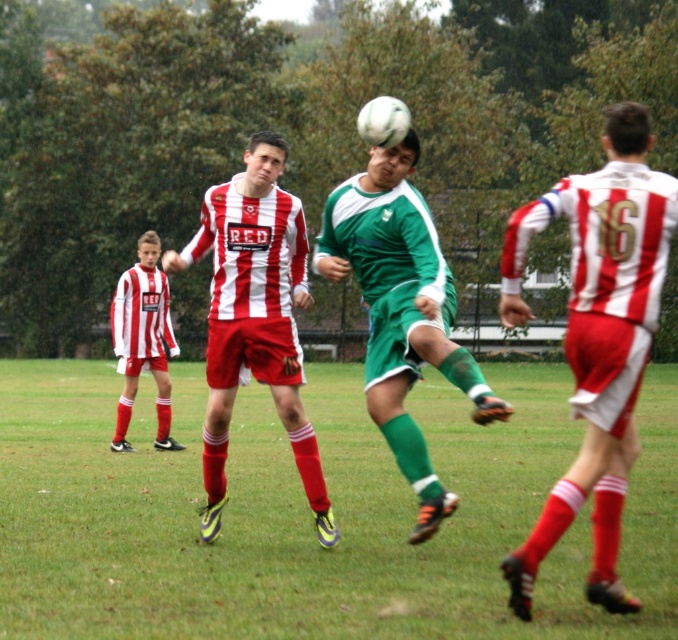
Is green grass at center wider than striped jersey at right?

Yes, green grass at center is wider than striped jersey at right.

Can you confirm if green grass at center is positioned above striped jersey at right?

No.

What are the coordinates of `green grass at center` in the screenshot? It's located at 308,513.

Does white matte soccer ball at center have a lesser width compared to striped jersey at right?

No, white matte soccer ball at center is not thinner than striped jersey at right.

Does white matte soccer ball at center have a lesser height compared to striped jersey at right?

No, white matte soccer ball at center is not shorter than striped jersey at right.

Where is `white matte soccer ball at center`? This screenshot has height=640, width=678. white matte soccer ball at center is located at coordinates (597, 337).

Who is taller, striped jersey at right or green matte soccer ball at center?

striped jersey at right is taller.

Is striped jersey at right wider than green matte soccer ball at center?

Yes, striped jersey at right is wider than green matte soccer ball at center.

What do you see at coordinates (597, 337) in the screenshot? The width and height of the screenshot is (678, 640). I see `striped jersey at right` at bounding box center [597, 337].

In order to click on striped jersey at right in this screenshot , I will do `click(597, 337)`.